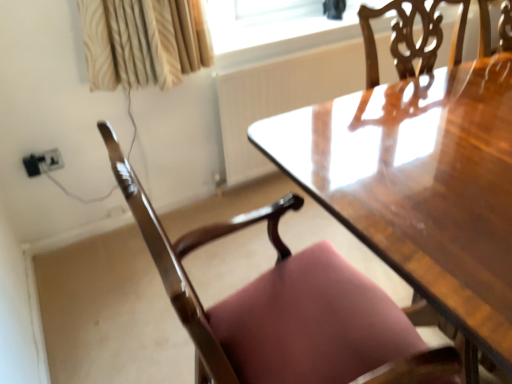
Question: From a real-world perspective, is transparent glass window screen at upper center positioned over black plastic outlet at lower left based on gravity?

Choices:
 (A) yes
 (B) no

Answer: (A)

Question: Is the surface of transparent glass window screen at upper center in direct contact with black plastic outlet at lower left?

Choices:
 (A) no
 (B) yes

Answer: (A)

Question: Is the position of transparent glass window screen at upper center less distant than that of black plastic outlet at lower left?

Choices:
 (A) yes
 (B) no

Answer: (B)

Question: Is transparent glass window screen at upper center completely or partially outside of black plastic outlet at lower left?

Choices:
 (A) yes
 (B) no

Answer: (A)

Question: From the image's perspective, is transparent glass window screen at upper center located beneath black plastic outlet at lower left?

Choices:
 (A) yes
 (B) no

Answer: (B)

Question: Is transparent glass window screen at upper center smaller than black plastic outlet at lower left?

Choices:
 (A) no
 (B) yes

Answer: (A)

Question: Is glossy wood chair at lower left far away from black plastic outlet at lower left?

Choices:
 (A) yes
 (B) no

Answer: (A)

Question: Is glossy wood chair at lower left smaller than black plastic outlet at lower left?

Choices:
 (A) no
 (B) yes

Answer: (A)

Question: Is glossy wood chair at lower left to the left of black plastic outlet at lower left from the viewer's perspective?

Choices:
 (A) yes
 (B) no

Answer: (B)

Question: Is glossy wood chair at lower left shorter than black plastic outlet at lower left?

Choices:
 (A) yes
 (B) no

Answer: (B)

Question: Is glossy wood chair at lower left placed right next to black plastic outlet at lower left?

Choices:
 (A) no
 (B) yes

Answer: (A)

Question: Is black plastic outlet at lower left at the back of glossy wood chair at lower left?

Choices:
 (A) yes
 (B) no

Answer: (B)

Question: Is black plastic outlet at lower left positioned in front of glossy wood chair at lower left?

Choices:
 (A) no
 (B) yes

Answer: (A)